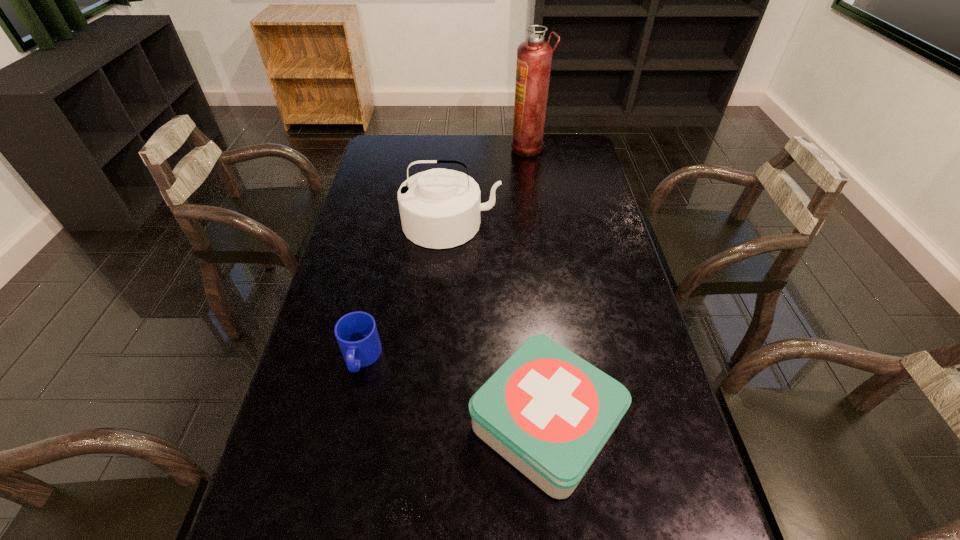
This screenshot has height=540, width=960. Identify the location of vacant space located 0.190m on the left of the first-aid kit. coord(387,423).

You are a GUI agent. You are given a task and a screenshot of the screen. Output one action in this format:
    pyautogui.click(x=<x>, y=<y>)
    Task: Click on the free space located on the side with the handle of the mug
    This screenshot has width=960, height=540.
    Given the screenshot: What is the action you would take?
    pyautogui.click(x=348, y=420)

The height and width of the screenshot is (540, 960). I want to click on object that is at the far edge, so click(534, 56).

I want to click on object that is at the left edge, so click(356, 332).

You are a GUI agent. You are given a task and a screenshot of the screen. Output one action in this format:
    pyautogui.click(x=<x>, y=<y>)
    Task: Click on the object at the right edge
    Image resolution: width=960 pixels, height=540 pixels.
    Given the screenshot: What is the action you would take?
    pos(548,412)

What are the coordinates of `vacant space at the left edge of the desktop` in the screenshot? It's located at (334, 281).

At what (x,y) coordinates should I click in order to perform the action: click on free space at the right edge of the desktop. Please return your answer as a coordinate pair (x, y). The width and height of the screenshot is (960, 540). Looking at the image, I should click on (585, 281).

I want to click on vacant space at the far left corner of the desktop, so click(x=381, y=159).

At what (x,y) coordinates should I click in order to perform the action: click on free space at the far right corner of the desktop. Please return your answer as a coordinate pair (x, y). The height and width of the screenshot is (540, 960). Looking at the image, I should click on (x=583, y=156).

Where is `free area in between the third shortest object and the fire extinguisher`? This screenshot has width=960, height=540. free area in between the third shortest object and the fire extinguisher is located at coordinates (490, 186).